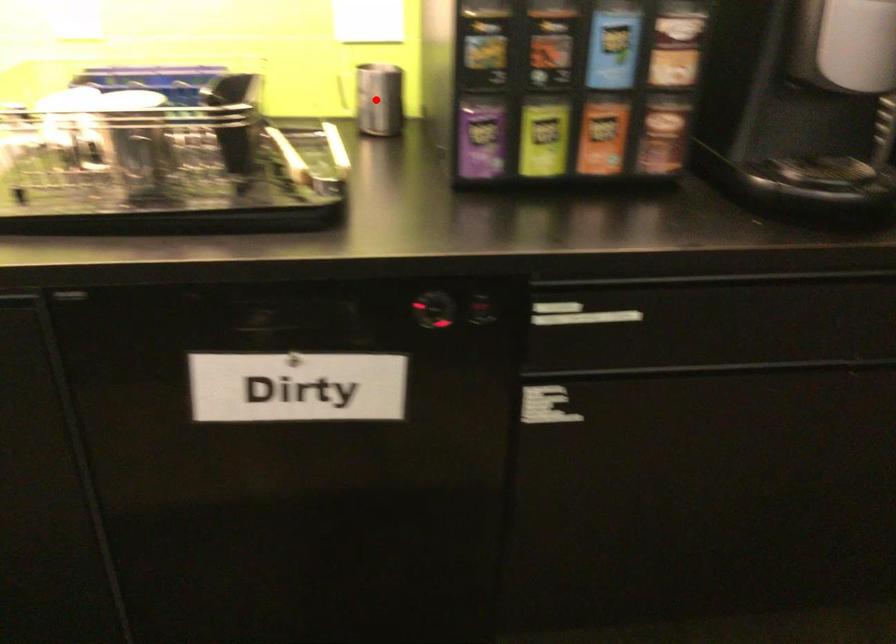
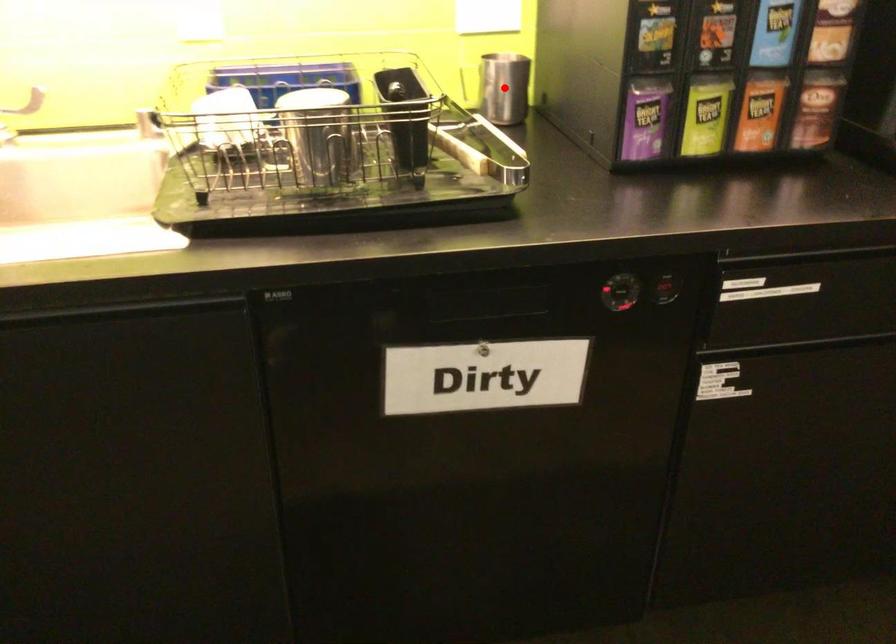
I am providing you with two images of the same scene from different viewpoints. A red point is marked on the first image and another point is marked on the second image. Is the marked point in image1 the same physical position as the marked point in image2?

Yes